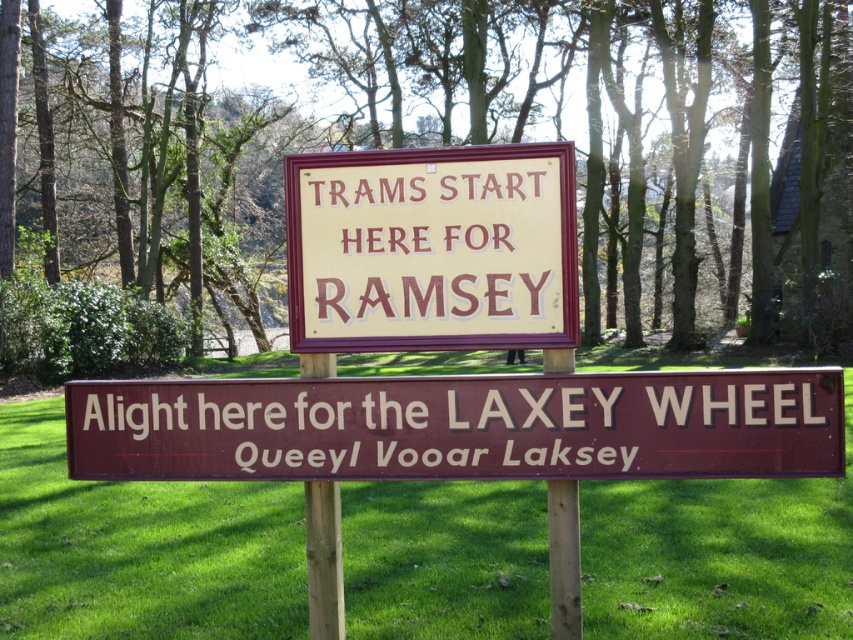
Question: Considering the relative positions of green leafy tree at center and brown wooden sign at center in the image provided, where is green leafy tree at center located with respect to brown wooden sign at center?

Choices:
 (A) right
 (B) left

Answer: (A)

Question: Which point is farther to the camera?

Choices:
 (A) (51, 616)
 (B) (357, 125)

Answer: (B)

Question: Which object appears closest to the camera in this image?

Choices:
 (A) green grass at lower center
 (B) yellow painted wood sign at center
 (C) green leafy tree at center
 (D) brown wooden sign at center

Answer: (D)

Question: Which of the following is the closest to the observer?

Choices:
 (A) yellow painted wood sign at center
 (B) green leafy tree at center
 (C) green grass at lower center

Answer: (A)

Question: Does brown wooden sign at center come behind yellow painted wood sign at center?

Choices:
 (A) no
 (B) yes

Answer: (A)

Question: Does green leafy tree at center have a larger size compared to brown wooden sign at center?

Choices:
 (A) yes
 (B) no

Answer: (A)